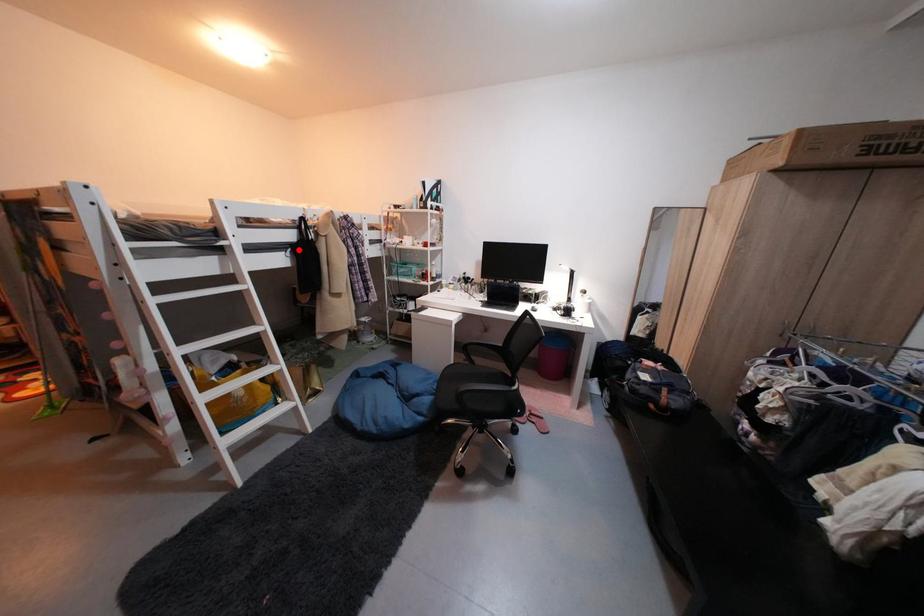
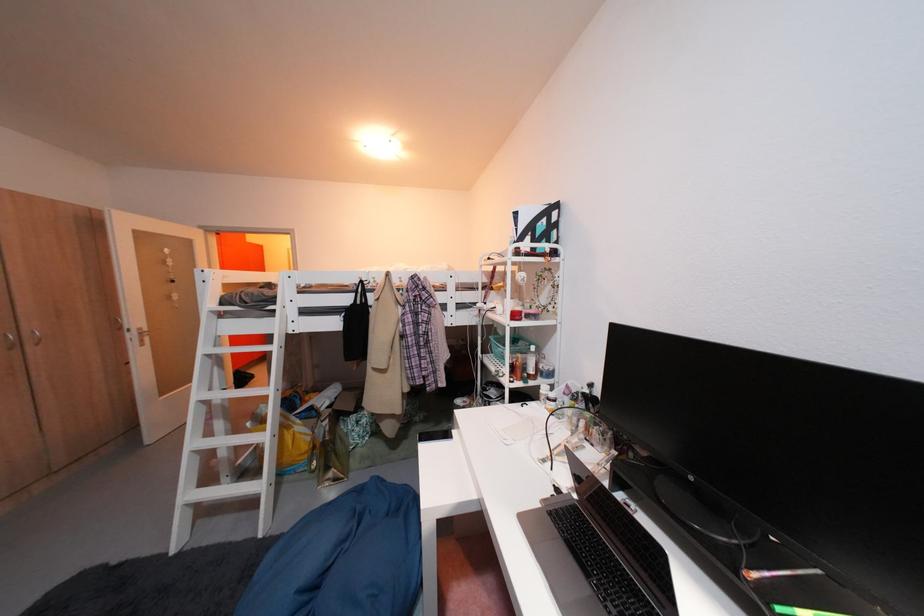
Find the pixel in the second image that matches the highlighted location in the first image.

(354, 314)